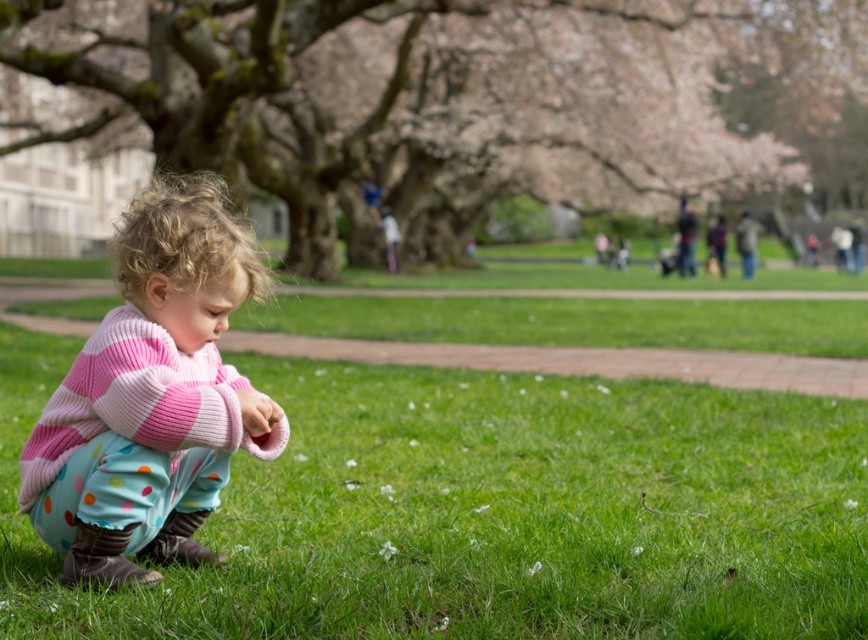
You are standing at the center of the image and want to walk towards the green grass at lower left located at point (x=484, y=512). Which direction should you face to head directly towards it?

You should face towards the lower left direction to head directly towards the green grass at lower left located at point (x=484, y=512).

You are a gardener who needs to plant a new flower bed. You have two areas to choose from in the scene. One is the green grass at lower left and the other is the rough bark tree at center. Which area would you choose for the flower bed and why?

You should choose the green grass at lower left for the flower bed because it has a lesser width compared to the rough bark tree at center, making it more suitable for planting flowers.

Based on the photo, you are standing in the park and want to reach the point marked as point (446, 172). If you can walk 4 meters per minute, how many minutes will it take you to reach that point?

The point (446, 172) is 36.70 meters away from the viewer. At a walking speed of 4 meters per minute, it would take approximately 9.18 minutes to reach the point. Since the question asks for the time in minutes, rounding to two decimal places gives about 9.18 minutes.